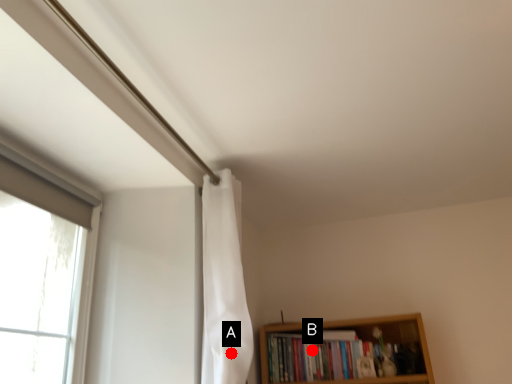
Question: Two points are circled on the image, labeled by A and B beside each circle. Which of the following is the farthest from the observer?

Choices:
 (A) A is further
 (B) B is further

Answer: (B)